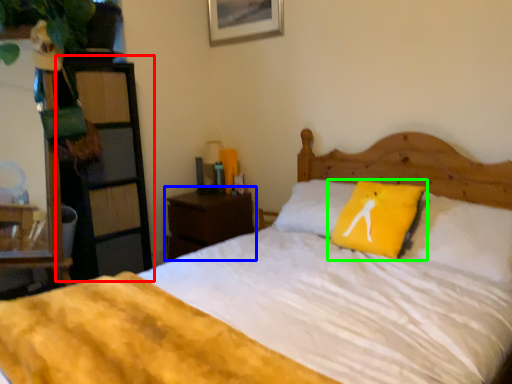
Question: Based on their relative distances, which object is nearer to dresser (highlighted by a red box)? Choose from nightstand (highlighted by a blue box) and pillow (highlighted by a green box).

Choices:
 (A) nightstand
 (B) pillow

Answer: (A)